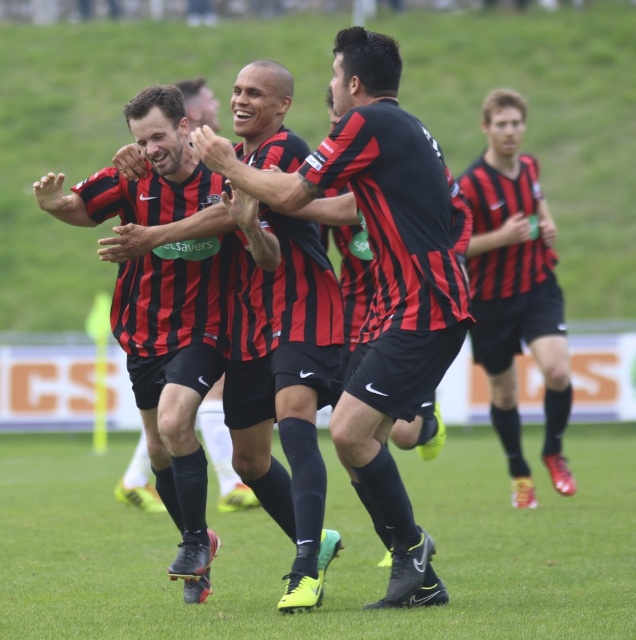
Question: Is green grass at center to the left of matte black shorts at right from the viewer's perspective?

Choices:
 (A) no
 (B) yes

Answer: (B)

Question: Which point is farther to the camera?

Choices:
 (A) matte black shorts at right
 (B) matte black jersey at center
 (C) green grass at center

Answer: (A)

Question: Can you confirm if green grass at center is positioned to the left of matte black shorts at right?

Choices:
 (A) yes
 (B) no

Answer: (A)

Question: Which point is closer to the camera?

Choices:
 (A) green grass at center
 (B) matte black shorts at right

Answer: (A)

Question: Does green grass at center have a lesser width compared to matte black jersey at center?

Choices:
 (A) yes
 (B) no

Answer: (B)

Question: Which object is positioned farthest from the matte black shorts at right?

Choices:
 (A) matte black jersey at center
 (B) green grass at center

Answer: (B)